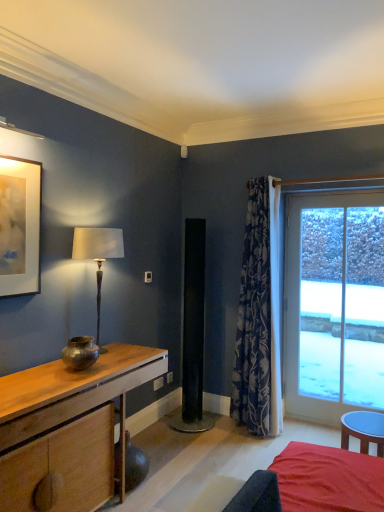
Question: Should I look upward or downward to see bronze metallic vase at left?

Choices:
 (A) down
 (B) up

Answer: (A)

Question: Does matte bronze lamp at left appear on the right side of wooden desk at left?

Choices:
 (A) yes
 (B) no

Answer: (A)

Question: Is matte bronze lamp at left positioned behind wooden desk at left?

Choices:
 (A) yes
 (B) no

Answer: (A)

Question: Considering the relative sizes of matte bronze lamp at left and wooden desk at left in the image provided, is matte bronze lamp at left shorter than wooden desk at left?

Choices:
 (A) no
 (B) yes

Answer: (A)

Question: Does matte bronze lamp at left have a smaller size compared to wooden desk at left?

Choices:
 (A) no
 (B) yes

Answer: (B)

Question: From the image's perspective, is matte bronze lamp at left beneath wooden desk at left?

Choices:
 (A) no
 (B) yes

Answer: (A)

Question: Is matte bronze lamp at left closer to the viewer compared to wooden desk at left?

Choices:
 (A) yes
 (B) no

Answer: (B)

Question: Is bronze metallic vase at left smaller than transparent glass door at right?

Choices:
 (A) yes
 (B) no

Answer: (A)

Question: Is bronze metallic vase at left facing away from transparent glass door at right?

Choices:
 (A) no
 (B) yes

Answer: (A)

Question: Does bronze metallic vase at left have a lesser height compared to transparent glass door at right?

Choices:
 (A) no
 (B) yes

Answer: (B)

Question: Could transparent glass door at right be considered to be inside bronze metallic vase at left?

Choices:
 (A) yes
 (B) no

Answer: (B)

Question: Considering the relative positions of bronze metallic vase at left and transparent glass door at right in the image provided, is bronze metallic vase at left to the right of transparent glass door at right from the viewer's perspective?

Choices:
 (A) no
 (B) yes

Answer: (A)

Question: From the image's perspective, is bronze metallic vase at left located above transparent glass door at right?

Choices:
 (A) yes
 (B) no

Answer: (B)

Question: From a real-world perspective, is wooden desk at left beneath velvet red bed at lower right?

Choices:
 (A) yes
 (B) no

Answer: (B)